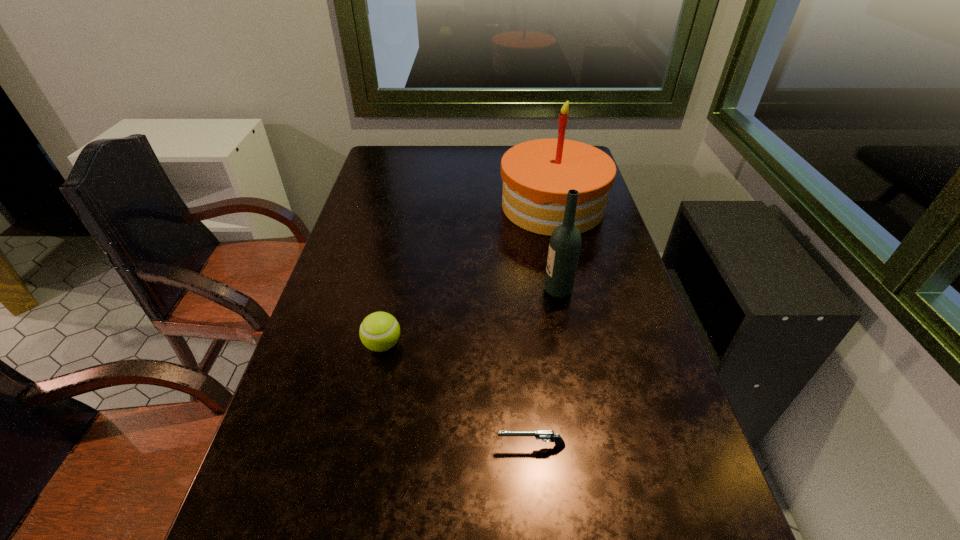
Where is `vacant space at the far left corner of the desktop`? The width and height of the screenshot is (960, 540). vacant space at the far left corner of the desktop is located at coordinates (396, 170).

Identify the location of free area in between the pistol and the second farthest object. The width and height of the screenshot is (960, 540). (544, 368).

Find the location of a particular element. unoccupied area between the shortest object and the third tallest object is located at coordinates (457, 395).

The width and height of the screenshot is (960, 540). In order to click on empty space that is in between the third tallest object and the birthday cake in this screenshot , I will do `click(468, 275)`.

Identify the location of vacant point located between the third shortest object and the third farthest object. pos(470,318).

Select which object appears as the third closest to the birthday cake. Please provide its 2D coordinates. Your answer should be formatted as a tuple, i.e. [(x, y)], where the tuple contains the x and y coordinates of a point satisfying the conditions above.

[(541, 434)]

The width and height of the screenshot is (960, 540). Find the location of `the second closest object to the third shortest object`. the second closest object to the third shortest object is located at coordinates (379, 331).

Image resolution: width=960 pixels, height=540 pixels. In order to click on free location that satisfies the following two spatial constraints: 1. on the front side of the birthday cake; 2. on the labeled side of the wine bottle in this screenshot , I will do `click(571, 291)`.

At what (x,y) coordinates should I click in order to perform the action: click on free space that satisfies the following two spatial constraints: 1. on the labeled side of the second farthest object; 2. on the front side of the tennis ball. Please return your answer as a coordinate pair (x, y). This screenshot has height=540, width=960. Looking at the image, I should click on [568, 345].